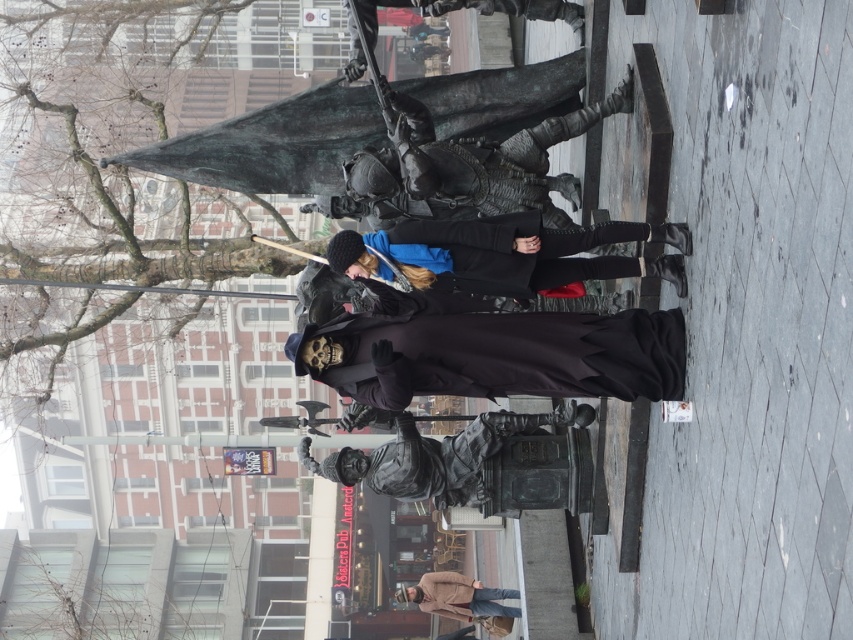
You are standing in the public square and want to walk towards the shiny black armor at upper center. Which direction should you move relative to the gray concrete pavement at lower right?

To reach the shiny black armor at upper center, you should move to the left relative to the gray concrete pavement at lower right, since the pavement is located to its right side.

You are standing in the public square and want to locate the shiny black armor at upper center. Which direction should you look to find it?

You should look towards the upper center direction to find the shiny black armor at upper center.